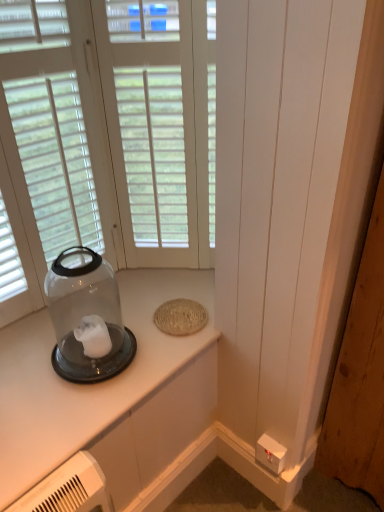
Image resolution: width=384 pixels, height=512 pixels. I want to click on vacant area that lies in front of white wood window at center, so [158, 292].